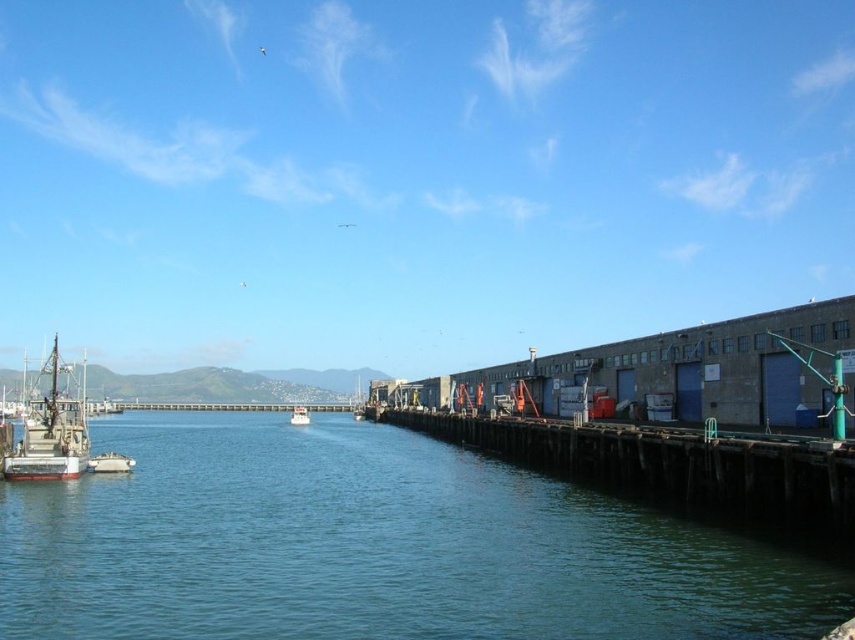
Is white matte boat at left wider than white matte boat at center?

Correct, the width of white matte boat at left exceeds that of white matte boat at center.

Between white matte boat at left and white matte boat at center, which one is positioned lower?

white matte boat at center is lower down.

Where is `white matte boat at left`? This screenshot has width=855, height=640. white matte boat at left is located at coordinates (51, 433).

Where is `white matte boat at left`? This screenshot has height=640, width=855. white matte boat at left is located at coordinates (51, 433).

Who is taller, greenish-blue water at left or wooden dock at lower right?

wooden dock at lower right

Consider the image. Who is positioned more to the left, greenish-blue water at left or wooden dock at lower right?

Positioned to the left is greenish-blue water at left.

Is point (360, 582) positioned before point (629, 449)?

That is True.

Identify the location of greenish-blue water at left. This screenshot has height=640, width=855. (373, 547).

Can you confirm if metallic gray boat at lower left is wider than white matte boat at center?

In fact, metallic gray boat at lower left might be narrower than white matte boat at center.

Is point (115, 472) farther from viewer compared to point (305, 420)?

No, (115, 472) is closer to viewer.

Locate an element on the screen. The image size is (855, 640). metallic gray boat at lower left is located at coordinates (110, 461).